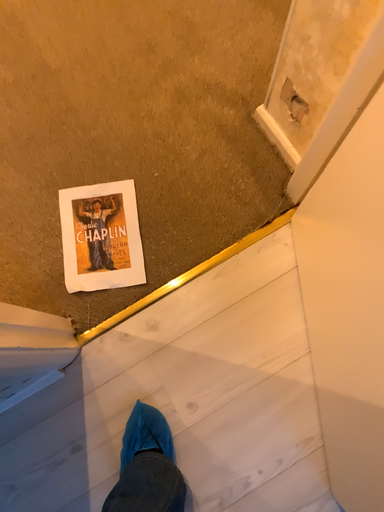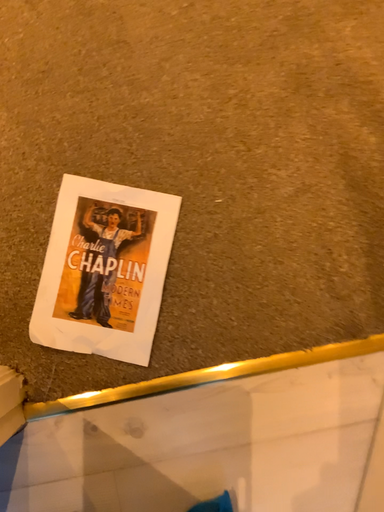
Question: Which way did the camera rotate in the video?

Choices:
 (A) rotated upward
 (B) rotated downward

Answer: (B)